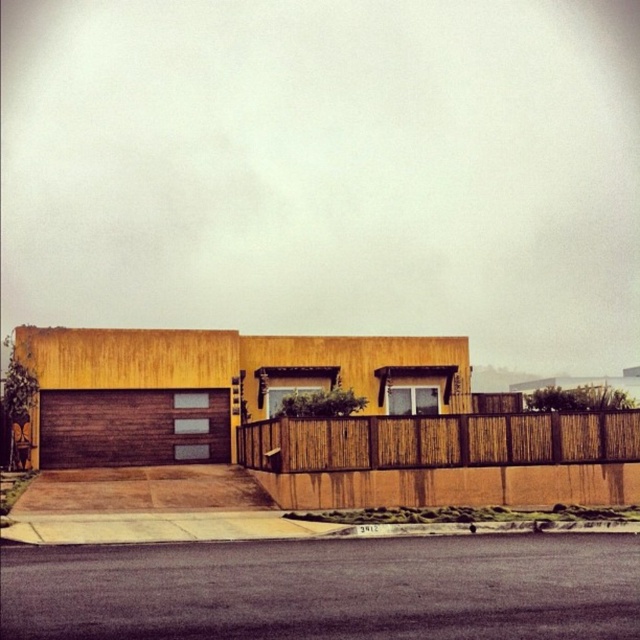
Question: Does brown wood garage at lower left lie behind bamboo fence at center?

Choices:
 (A) yes
 (B) no

Answer: (A)

Question: Is brown wood garage at lower left smaller than brown textured garage door at lower left?

Choices:
 (A) no
 (B) yes

Answer: (A)

Question: Among these objects, which one is nearest to the camera?

Choices:
 (A) bamboo fence at center
 (B) brown textured garage door at lower left
 (C) brown wood garage at lower left

Answer: (A)

Question: Which of these objects is positioned farthest from the brown textured garage door at lower left?

Choices:
 (A) bamboo fence at center
 (B) brown wood garage at lower left

Answer: (A)

Question: Which point is closer to the camera?

Choices:
 (A) brown textured garage door at lower left
 (B) brown wood garage at lower left

Answer: (B)

Question: Can you confirm if brown wood garage at lower left is wider than bamboo fence at center?

Choices:
 (A) no
 (B) yes

Answer: (B)